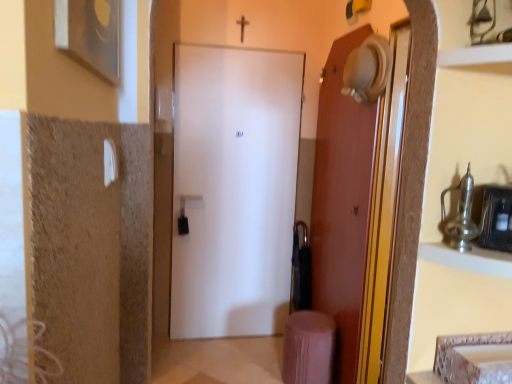
Question: Can you confirm if pink fabric stool at lower right is shorter than metallic silver medicine cabinet at right?

Choices:
 (A) no
 (B) yes

Answer: (A)

Question: From the image's perspective, does pink fabric stool at lower right appear lower than metallic silver medicine cabinet at right?

Choices:
 (A) no
 (B) yes

Answer: (B)

Question: Is pink fabric stool at lower right thinner than metallic silver medicine cabinet at right?

Choices:
 (A) no
 (B) yes

Answer: (A)

Question: Is there a large distance between pink fabric stool at lower right and metallic silver medicine cabinet at right?

Choices:
 (A) yes
 (B) no

Answer: (A)

Question: Is pink fabric stool at lower right smaller than metallic silver medicine cabinet at right?

Choices:
 (A) no
 (B) yes

Answer: (A)

Question: Is metallic silver medicine cabinet at right located within pink fabric stool at lower right?

Choices:
 (A) yes
 (B) no

Answer: (B)

Question: Can you confirm if pink fabric stool at lower right is bigger than metallic silver shelf at upper right?

Choices:
 (A) yes
 (B) no

Answer: (A)

Question: From the image's perspective, would you say pink fabric stool at lower right is shown under metallic silver shelf at upper right?

Choices:
 (A) yes
 (B) no

Answer: (A)

Question: Could metallic silver shelf at upper right be considered to be inside pink fabric stool at lower right?

Choices:
 (A) no
 (B) yes

Answer: (A)

Question: Does pink fabric stool at lower right have a lesser width compared to metallic silver shelf at upper right?

Choices:
 (A) yes
 (B) no

Answer: (B)

Question: Is pink fabric stool at lower right aimed at metallic silver shelf at upper right?

Choices:
 (A) no
 (B) yes

Answer: (A)

Question: Is pink fabric stool at lower right wider than metallic silver shelf at upper right?

Choices:
 (A) no
 (B) yes

Answer: (B)

Question: Can you confirm if pink fabric stool at lower right is positioned to the left of metallic silver cabinet at upper right?

Choices:
 (A) no
 (B) yes

Answer: (B)